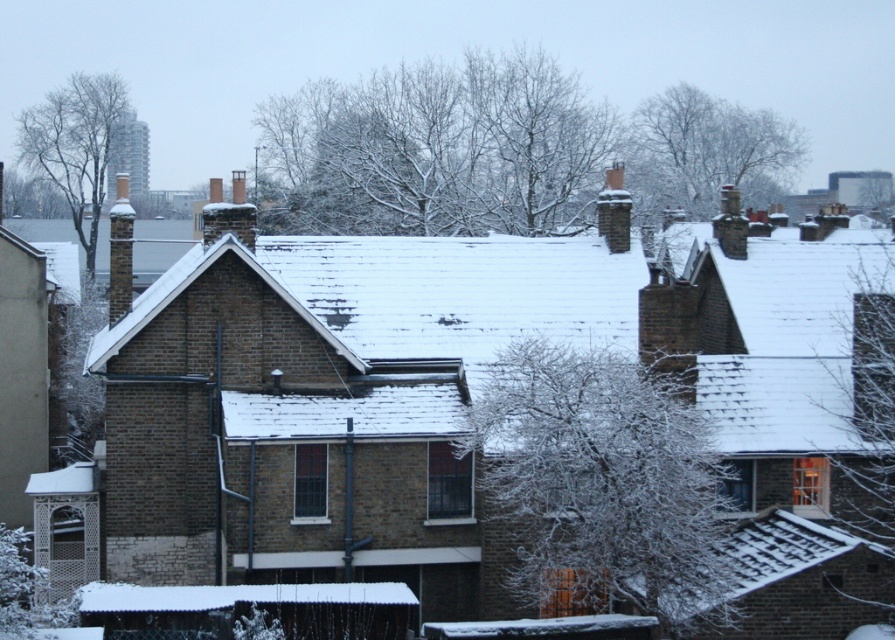
Can you confirm if snow-covered branches at upper center is positioned below bare branches at upper left?

Yes.

Where is `snow-covered branches at upper center`? The width and height of the screenshot is (895, 640). snow-covered branches at upper center is located at coordinates click(x=706, y=150).

Does point (480, 88) come farther from viewer compared to point (520, 582)?

Yes, point (480, 88) is behind point (520, 582).

Is snow-covered branches at center below white frosty branches at center?

Incorrect, snow-covered branches at center is not positioned below white frosty branches at center.

Where is `snow-covered branches at center`? Image resolution: width=895 pixels, height=640 pixels. snow-covered branches at center is located at coordinates (499, 150).

This screenshot has height=640, width=895. What are the coordinates of `snow-covered branches at center` in the screenshot? It's located at (499, 150).

Can you confirm if white frosty branches at center is positioned to the left of snow-covered branches at upper center?

Indeed, white frosty branches at center is positioned on the left side of snow-covered branches at upper center.

Identify the location of white frosty branches at center. (601, 484).

What are the coordinates of `white frosty branches at center` in the screenshot? It's located at (601, 484).